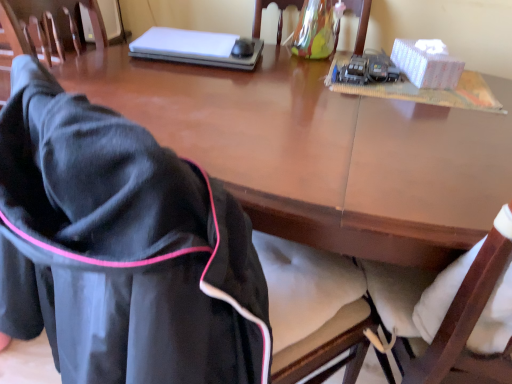
This screenshot has width=512, height=384. I want to click on white matte laptop at upper center, so point(198,48).

What is the approximate width of black plastic mouse at upper center?

4.63 inches.

Identify the location of white matte laptop at upper center. (198, 48).

Would you say black plastic mouse at upper center is to the left or to the right of transparent glass vase at upper center, which is the second chair from front to back, in the picture?

black plastic mouse at upper center is positioned on transparent glass vase at upper center, which is the second chair from front to back,'s left side.

Are black plastic mouse at upper center and transparent glass vase at upper center, the 2th chair from the bottom, located far from each other?

No.

Between black plastic mouse at upper center and transparent glass vase at upper center, the first chair viewed from the right, which one has less height?

black plastic mouse at upper center.

Which is more to the right, black fabric jacket at lower left, which appears as the 2th chair when viewed from the right, or white cardboard box at upper right?

white cardboard box at upper right.

Is black fabric jacket at lower left, the 1th chair in the left-to-right sequence, looking in the opposite direction of white cardboard box at upper right?

Yes.

Considering the points (37, 162) and (425, 65), which point is in front, point (37, 162) or point (425, 65)?

The point (37, 162) is in front.

From the image's perspective, between black fabric jacket at lower left, positioned as the 1th chair in front-to-back order, and white cardboard box at upper right, who is located below?

black fabric jacket at lower left, positioned as the 1th chair in front-to-back order.

Is black plastic mouse at upper center looking in the opposite direction of white cardboard box at upper right?

black plastic mouse at upper center is not turned away from white cardboard box at upper right.

Between black plastic mouse at upper center and white cardboard box at upper right, which one appears on the left side from the viewer's perspective?

Positioned to the left is black plastic mouse at upper center.

Is black plastic mouse at upper center in contact with white cardboard box at upper right?

They are not placed beside each other.

Does black plastic mouse at upper center have a greater width compared to white cardboard box at upper right?

In fact, black plastic mouse at upper center might be narrower than white cardboard box at upper right.

Who is smaller, black fabric jacket at lower left, which appears as the 2th chair when viewed from the right, or white matte laptop at upper center?

Smaller between the two is white matte laptop at upper center.

How different are the orientations of black fabric jacket at lower left, which is the 1th chair from bottom to top, and white matte laptop at upper center in degrees?

The angular difference between black fabric jacket at lower left, which is the 1th chair from bottom to top, and white matte laptop at upper center is 36.8 degrees.

Could you tell me if black fabric jacket at lower left, which ranks as the 2th chair in back-to-front order, is facing white matte laptop at upper center?

No, black fabric jacket at lower left, which ranks as the 2th chair in back-to-front order, is not aimed at white matte laptop at upper center.

Is black fabric jacket at lower left, which appears as the second chair when viewed from the top, situated inside white matte laptop at upper center or outside?

black fabric jacket at lower left, which appears as the second chair when viewed from the top, cannot be found inside white matte laptop at upper center.

Is transparent glass vase at upper center, the first chair positioned from the back, positioned far away from black plastic mouse at upper center?

Actually, transparent glass vase at upper center, the first chair positioned from the back, and black plastic mouse at upper center are a little close together.

Is transparent glass vase at upper center, the first chair positioned from the back, inside the boundaries of black plastic mouse at upper center, or outside?

transparent glass vase at upper center, the first chair positioned from the back, lies outside black plastic mouse at upper center.

How different are the orientations of transparent glass vase at upper center, the first chair viewed from the right, and black plastic mouse at upper center in degrees?

The angular difference between transparent glass vase at upper center, the first chair viewed from the right, and black plastic mouse at upper center is 4.23 degrees.

Does transparent glass vase at upper center, the first chair viewed from the right, turn towards black plastic mouse at upper center?

No, transparent glass vase at upper center, the first chair viewed from the right, is not oriented towards black plastic mouse at upper center.

How much distance is there between white matte laptop at upper center and transparent glass vase at upper center, which is the second chair from front to back?

14.17 inches.

Can you confirm if white matte laptop at upper center is shorter than transparent glass vase at upper center, the second chair in the left-to-right sequence?

Yes.

Is point (233, 57) more distant than point (257, 19)?

No, it is in front of (257, 19).

From a real-world perspective, is white matte laptop at upper center physically above transparent glass vase at upper center, the second chair in the left-to-right sequence?

Incorrect, from a real-world perspective, white matte laptop at upper center is lower than transparent glass vase at upper center, the second chair in the left-to-right sequence.

Which of these two, white cardboard box at upper right or transparent glass vase at upper center, the second chair in the left-to-right sequence, stands shorter?

white cardboard box at upper right is shorter.

I want to click on box on the right of transparent glass vase at upper center, the first chair positioned from the back, so click(426, 63).

From the image's perspective, between white cardboard box at upper right and transparent glass vase at upper center, which is the first chair from top to bottom, who is located below?

white cardboard box at upper right appears lower in the image.

How many degrees apart are the facing directions of white cardboard box at upper right and transparent glass vase at upper center, which is the first chair from top to bottom?

The angular difference between white cardboard box at upper right and transparent glass vase at upper center, which is the first chair from top to bottom, is 19.8 degrees.

Locate an element on the screen. The image size is (512, 384). mouse that is on the left side of transparent glass vase at upper center, the first chair viewed from the right is located at coordinates (243, 48).

The image size is (512, 384). In order to click on chair that appears below the white cardboard box at upper right (from the image's perspective) in this screenshot , I will do `click(148, 256)`.

Based on their spatial positions, is black plastic mouse at upper center or transparent glass vase at upper center, the first chair viewed from the right, closer to black fabric jacket at lower left, which appears as the 2th chair when viewed from the right?

black plastic mouse at upper center is positioned closer to the anchor black fabric jacket at lower left, which appears as the 2th chair when viewed from the right.

Based on the photo, when comparing their distances from black fabric jacket at lower left, which appears as the 2th chair when viewed from the right, does white matte laptop at upper center or transparent glass vase at upper center, the first chair positioned from the back, seem further?

The object further to black fabric jacket at lower left, which appears as the 2th chair when viewed from the right, is transparent glass vase at upper center, the first chair positioned from the back.

Considering their positions, is transparent glass vase at upper center, which is the first chair from top to bottom, positioned further to white matte laptop at upper center than black fabric jacket at lower left, the 1th chair in the left-to-right sequence?

black fabric jacket at lower left, the 1th chair in the left-to-right sequence.

In the scene shown: Estimate the real-world distances between objects in this image. Which object is closer to black plastic mouse at upper center, white cardboard box at upper right or black fabric jacket at lower left, which is the 1th chair from bottom to top?

white cardboard box at upper right lies closer to black plastic mouse at upper center than the other object.

Estimate the real-world distances between objects in this image. Which object is further from white cardboard box at upper right, black fabric jacket at lower left, the 1th chair in the left-to-right sequence, or black plastic mouse at upper center?

black fabric jacket at lower left, the 1th chair in the left-to-right sequence.

From the image, which object appears to be farther from white matte laptop at upper center, transparent glass vase at upper center, the first chair positioned from the back, or white cardboard box at upper right?

Among the two, white cardboard box at upper right is located further to white matte laptop at upper center.

Based on their spatial positions, is white matte laptop at upper center or black plastic mouse at upper center closer to black fabric jacket at lower left, the 1th chair in the left-to-right sequence?

white matte laptop at upper center is closer to black fabric jacket at lower left, the 1th chair in the left-to-right sequence.

Which object lies nearer to the anchor point black fabric jacket at lower left, which appears as the second chair when viewed from the top, white cardboard box at upper right or transparent glass vase at upper center, which is the second chair from front to back?

The object closer to black fabric jacket at lower left, which appears as the second chair when viewed from the top, is white cardboard box at upper right.

Image resolution: width=512 pixels, height=384 pixels. Identify the location of chair situated between white matte laptop at upper center and white cardboard box at upper right from left to right. (360, 21).

Where is `chair between black fabric jacket at lower left, which appears as the 2th chair when viewed from the right, and white matte laptop at upper center, along the z-axis`? chair between black fabric jacket at lower left, which appears as the 2th chair when viewed from the right, and white matte laptop at upper center, along the z-axis is located at coordinates (360, 21).

What are the coordinates of `box positioned between black fabric jacket at lower left, positioned as the 1th chair in front-to-back order, and white matte laptop at upper center from near to far` in the screenshot? It's located at (426, 63).

Identify the location of mouse located between white matte laptop at upper center and white cardboard box at upper right in the left-right direction. This screenshot has height=384, width=512. (243, 48).